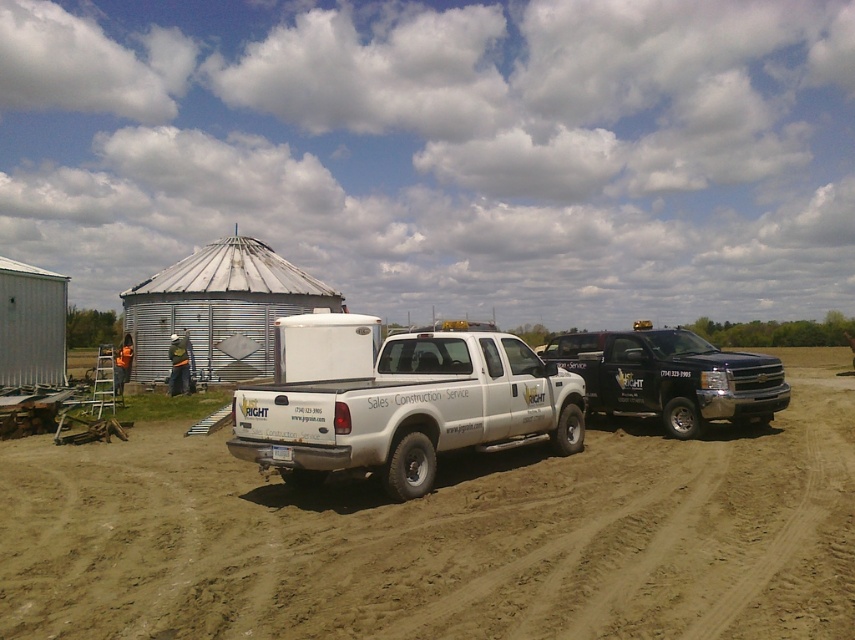
Question: Which object is positioned closest to the dirt field at center?

Choices:
 (A) black glossy truck at right
 (B) white matte truck at center

Answer: (B)

Question: Does white matte truck at center have a larger size compared to black glossy truck at right?

Choices:
 (A) yes
 (B) no

Answer: (A)

Question: Based on their relative distances, which object is nearer to the white matte truck at center?

Choices:
 (A) black glossy truck at right
 (B) dirt field at center

Answer: (B)

Question: Does dirt field at center appear on the left side of black glossy truck at right?

Choices:
 (A) yes
 (B) no

Answer: (A)

Question: In this image, where is dirt field at center located relative to white matte truck at center?

Choices:
 (A) right
 (B) left

Answer: (A)

Question: Which is farther from the black glossy truck at right?

Choices:
 (A) dirt field at center
 (B) white matte truck at center

Answer: (B)